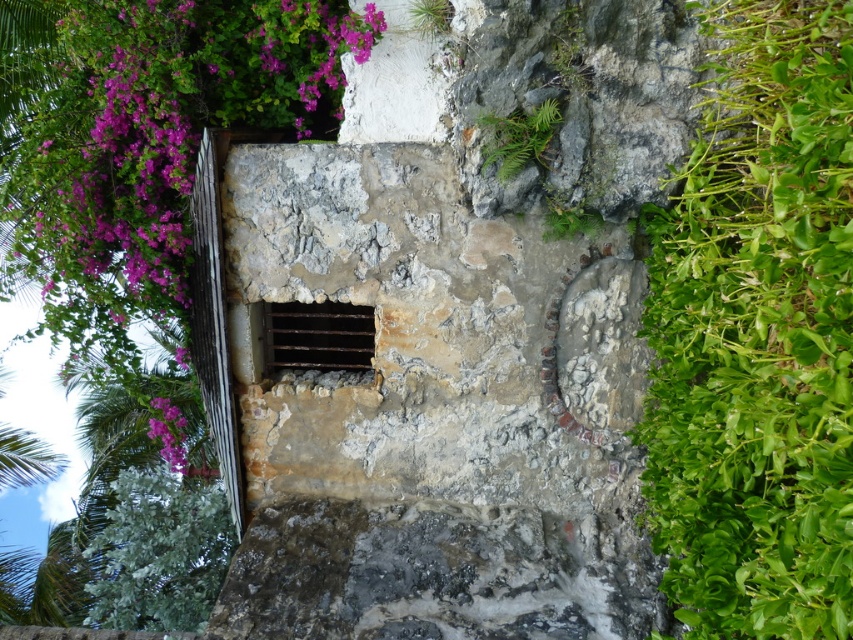
You are standing in front of the rustic stone structure and see two points marked on it. One is at coordinate point [810,257] and the other at point [172,413]. Which point is closer to you?

Point [810,257] is in front of point [172,413], so it is closer to you.

You are a gardener planning to plant a new flower bed near the rustic stone structure. You notice the green leafy plant at right and the purple matte flower at upper left. Which of these two plants has a larger spread, meaning it occupies more horizontal space?

The green leafy plant at right might be wider than purple matte flower at upper left, so it likely has a larger spread and occupies more horizontal space.

You are a gardener who needs to water both the green leafy plant at right and the purple matte flower at upper left. Your watering can has a range of 4 meters. Can you water both plants from your current position without moving?

The green leafy plant at right is 3.98 meters from the purple matte flower at upper left. Since the distance between them is within the watering can range of 4 meters, you can water both plants from your current position without moving.